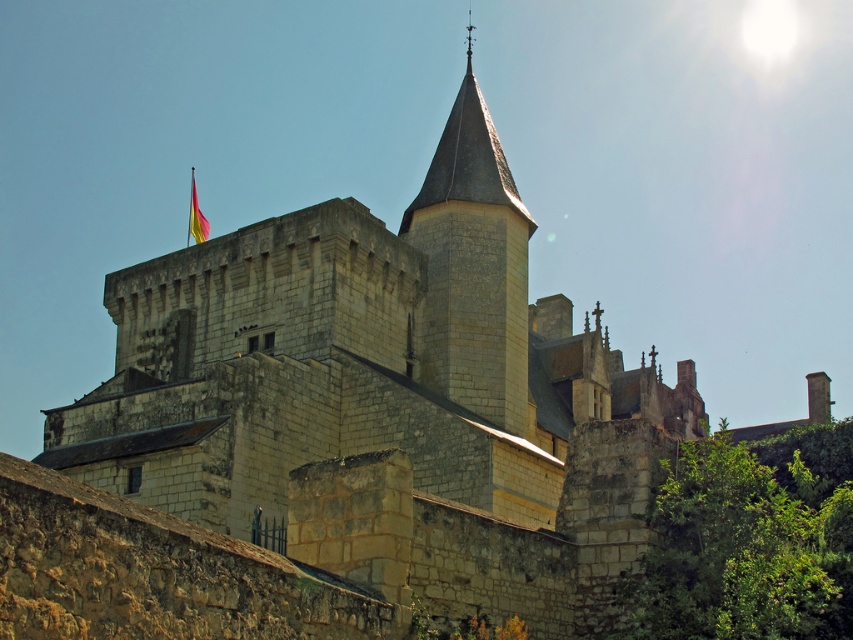
Can you confirm if stone steeple at upper center is shorter than silky yellow flag at upper center?

No, stone steeple at upper center is not shorter than silky yellow flag at upper center.

Which is in front, point (477, 307) or point (189, 212)?

Point (477, 307) is more forward.

The width and height of the screenshot is (853, 640). In order to click on stone steeple at upper center in this screenshot , I will do point(473,266).